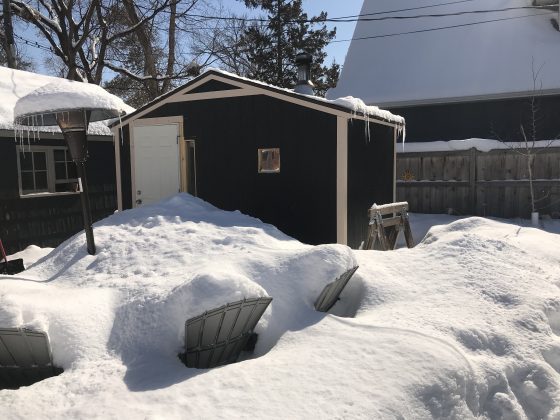
Where is `1 window on right`? The width and height of the screenshot is (560, 420). 1 window on right is located at coordinates (268, 156).